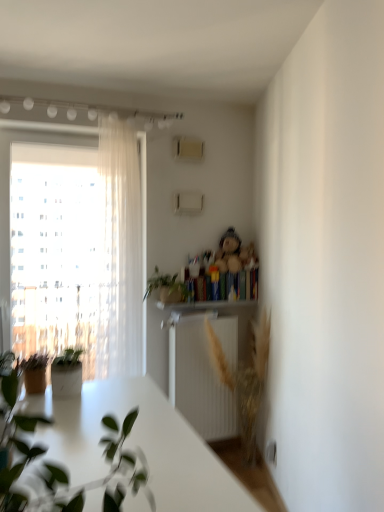
Question: From the image's perspective, is sheer white curtain at left below green matte plant at center, the 2th houseplant positioned from the front?

Choices:
 (A) yes
 (B) no

Answer: (B)

Question: Is sheer white curtain at left facing towards green matte plant at center, the 2th houseplant positioned from the front?

Choices:
 (A) no
 (B) yes

Answer: (A)

Question: Considering the relative sizes of sheer white curtain at left and green matte plant at center, the 2th houseplant positioned from the front, in the image provided, is sheer white curtain at left taller than green matte plant at center, the 2th houseplant positioned from the front,?

Choices:
 (A) yes
 (B) no

Answer: (A)

Question: Is there a large distance between sheer white curtain at left and green matte plant at center, the 2th houseplant positioned from the front?

Choices:
 (A) yes
 (B) no

Answer: (B)

Question: Does sheer white curtain at left appear on the right side of green matte plant at center, the 2th houseplant positioned from the front?

Choices:
 (A) yes
 (B) no

Answer: (B)

Question: From a real-world perspective, is sheer white curtain at left physically located above or below hardcover book at center?

Choices:
 (A) below
 (B) above

Answer: (B)

Question: Is point (132, 169) closer or farther from the camera than point (223, 271)?

Choices:
 (A) farther
 (B) closer

Answer: (B)

Question: Based on their positions, is sheer white curtain at left located to the left or right of hardcover book at center?

Choices:
 (A) right
 (B) left

Answer: (B)

Question: Is sheer white curtain at left taller or shorter than hardcover book at center?

Choices:
 (A) tall
 (B) short

Answer: (A)

Question: From a real-world perspective, is wooden shelf at upper center above or below fluffy beige teddy bear at upper center?

Choices:
 (A) above
 (B) below

Answer: (B)

Question: From the image's perspective, is wooden shelf at upper center positioned above or below fluffy beige teddy bear at upper center?

Choices:
 (A) above
 (B) below

Answer: (B)

Question: In the image, is wooden shelf at upper center positioned in front of or behind fluffy beige teddy bear at upper center?

Choices:
 (A) behind
 (B) front

Answer: (B)

Question: Considering the positions of point (210, 302) and point (223, 249), is point (210, 302) closer or farther from the camera than point (223, 249)?

Choices:
 (A) farther
 (B) closer

Answer: (B)

Question: From their relative heights in the image, would you say fluffy beige teddy bear at upper center is taller or shorter than green matte plant at center, which is counted as the first houseplant, starting from the back?

Choices:
 (A) short
 (B) tall

Answer: (B)

Question: Is fluffy beige teddy bear at upper center spatially inside green matte plant at center, the 2th houseplant positioned from the front, or outside of it?

Choices:
 (A) inside
 (B) outside

Answer: (B)